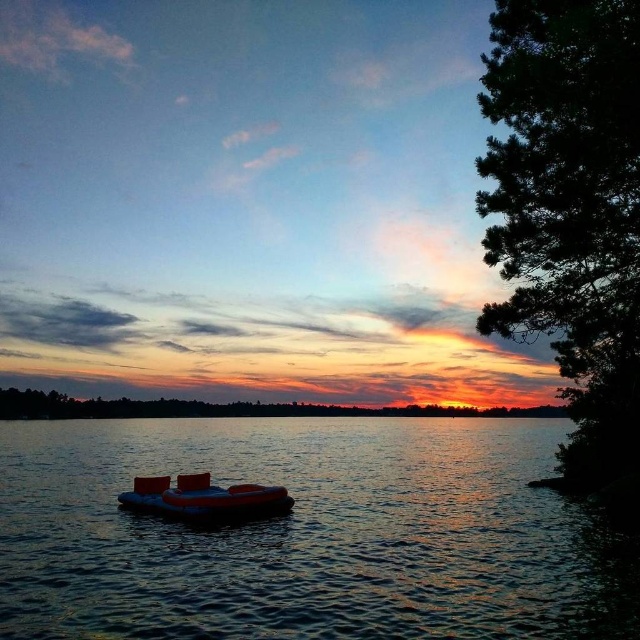
Question: Which of these objects is positioned farthest from the orange rubber boat at center?

Choices:
 (A) green leafy tree at center
 (B) translucent rubber boat at center

Answer: (A)

Question: Can you confirm if green leafy tree at center is smaller than orange rubber boat at center?

Choices:
 (A) no
 (B) yes

Answer: (A)

Question: Which point is closer to the camera?

Choices:
 (A) orange rubber boat at center
 (B) green leafy tree at center
 (C) translucent rubber boat at center

Answer: (C)

Question: Is green textured tree at right positioned behind orange rubber boat at center?

Choices:
 (A) yes
 (B) no

Answer: (B)

Question: Can you confirm if green textured tree at right is thinner than green leafy tree at center?

Choices:
 (A) no
 (B) yes

Answer: (B)

Question: Among these points, which one is nearest to the camera?

Choices:
 (A) (512, 109)
 (B) (3, 392)

Answer: (A)